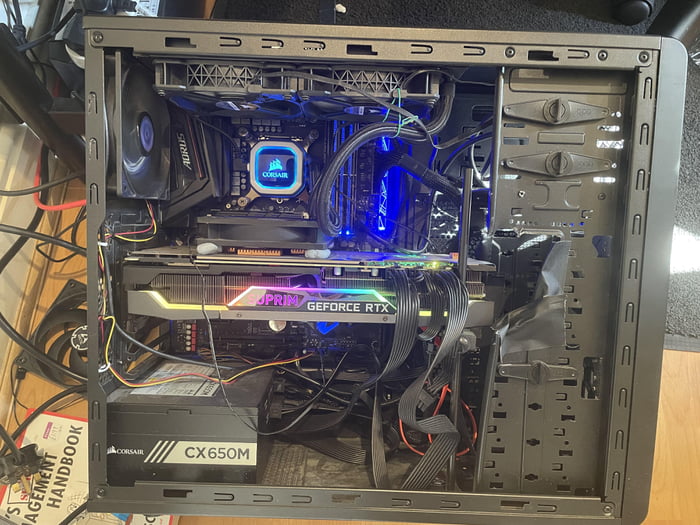
You are a GUI agent. You are given a task and a screenshot of the screen. Output one action in this format:
    pyautogui.click(x=<x>, y=<y>)
    Task: Click on the grey rug
    
    Given the screenshot: What is the action you would take?
    coord(686,301)